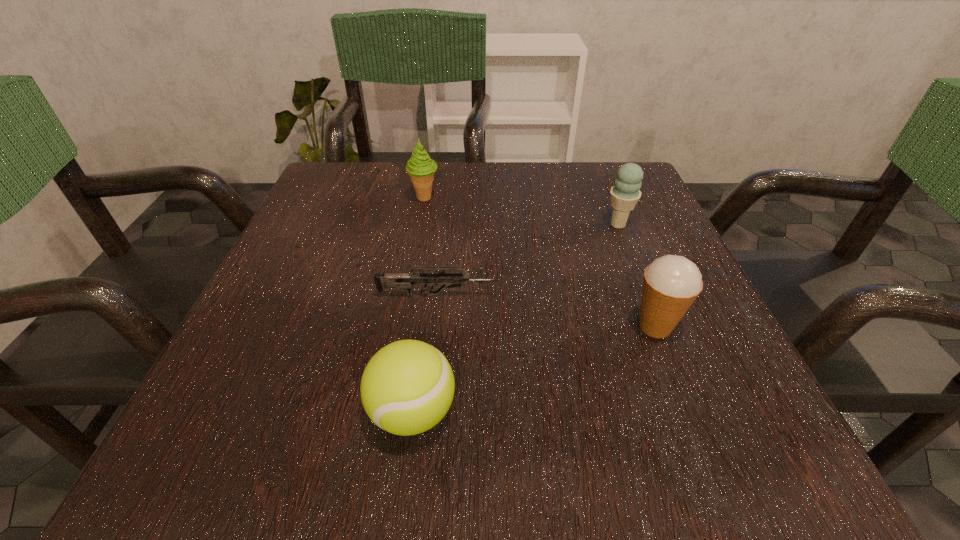
This screenshot has height=540, width=960. Find the location of `free spot located 0.240m on the back of the nearest icecream`. free spot located 0.240m on the back of the nearest icecream is located at coordinates (614, 224).

This screenshot has width=960, height=540. Identify the location of vacant space situated 0.150m on the left of the tennis ball. (255, 412).

At what (x,y) coordinates should I click in order to perform the action: click on free region located 0.120m aimed along the barrel of the gun. Please return your answer as a coordinate pair (x, y). Looking at the image, I should click on (569, 295).

Identify the location of object at the near edge. The height and width of the screenshot is (540, 960). click(x=407, y=387).

Locate an element on the screen. The height and width of the screenshot is (540, 960). object present at the far right corner is located at coordinates (626, 193).

Identify the location of free space at the far edge of the desktop. This screenshot has width=960, height=540. (546, 163).

In the image, there is a desktop. Where is `vacant area at the near edge`? Image resolution: width=960 pixels, height=540 pixels. vacant area at the near edge is located at coordinates (588, 431).

I want to click on vacant space at the left edge, so click(x=359, y=279).

Find the location of `free space at the right edge of the desktop`. free space at the right edge of the desktop is located at coordinates (636, 219).

The height and width of the screenshot is (540, 960). In order to click on free spot at the far left corner of the desktop in this screenshot , I will do `click(375, 170)`.